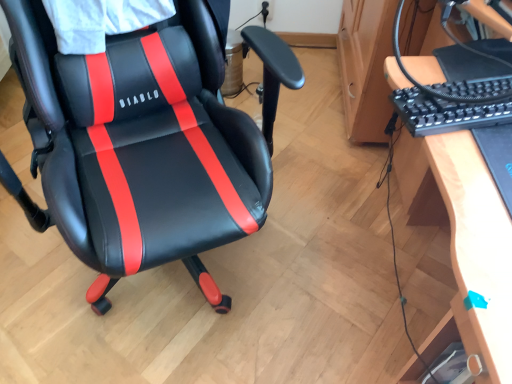
Question: Is black plastic keyboard at right spatially inside wooden desk at right, or outside of it?

Choices:
 (A) outside
 (B) inside

Answer: (A)

Question: Is point (444, 94) closer or farther from the camera than point (500, 345)?

Choices:
 (A) closer
 (B) farther

Answer: (B)

Question: Estimate the real-world distances between objects in this image. Which object is closer to the wooden desk at right?

Choices:
 (A) black leather chair at center
 (B) black plastic keyboard at right

Answer: (B)

Question: Estimate the real-world distances between objects in this image. Which object is closer to the black plastic keyboard at right?

Choices:
 (A) wooden desk at right
 (B) black leather chair at center

Answer: (A)